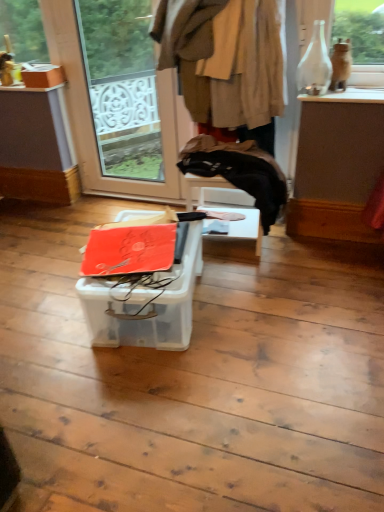
Question: Is orange matte cardboard box at center, the second cardboard box viewed from the top, thinner than brown woolen coat at upper center?

Choices:
 (A) no
 (B) yes

Answer: (A)

Question: Is orange matte cardboard box at center, the second cardboard box in the back-to-front sequence, closer to camera compared to brown woolen coat at upper center?

Choices:
 (A) yes
 (B) no

Answer: (A)

Question: Does orange matte cardboard box at center, which is the 1th cardboard box in bottom-to-top order, touch brown woolen coat at upper center?

Choices:
 (A) yes
 (B) no

Answer: (B)

Question: Does orange matte cardboard box at center, the second cardboard box in the back-to-front sequence, have a greater width compared to brown woolen coat at upper center?

Choices:
 (A) yes
 (B) no

Answer: (A)

Question: Is orange matte cardboard box at center, placed as the 1th cardboard box when sorted from right to left, oriented towards brown woolen coat at upper center?

Choices:
 (A) yes
 (B) no

Answer: (B)

Question: Is point (144, 16) positioned closer to the camera than point (253, 39)?

Choices:
 (A) closer
 (B) farther

Answer: (B)

Question: From the image's perspective, is transparent glass door at upper left located above or below brown woolen coat at upper center?

Choices:
 (A) above
 (B) below

Answer: (B)

Question: Based on their sizes in the image, would you say transparent glass door at upper left is bigger or smaller than brown woolen coat at upper center?

Choices:
 (A) small
 (B) big

Answer: (A)

Question: Is transparent glass door at upper left inside or outside of brown woolen coat at upper center?

Choices:
 (A) outside
 (B) inside

Answer: (A)

Question: Choose the correct answer: Is orange matte cardboard box at center, the second cardboard box in the back-to-front sequence, inside brown woolen coat at upper center or outside it?

Choices:
 (A) inside
 (B) outside

Answer: (B)

Question: Is point (190, 300) positioned closer to the camera than point (225, 119)?

Choices:
 (A) closer
 (B) farther

Answer: (A)

Question: Considering the relative positions of orange matte cardboard box at center, acting as the first cardboard box starting from the front, and brown woolen coat at upper center in the image provided, is orange matte cardboard box at center, acting as the first cardboard box starting from the front, to the left or to the right of brown woolen coat at upper center?

Choices:
 (A) right
 (B) left

Answer: (B)

Question: Considering the positions of orange matte cardboard box at center, acting as the first cardboard box starting from the front, and brown woolen coat at upper center in the image, is orange matte cardboard box at center, acting as the first cardboard box starting from the front, wider or thinner than brown woolen coat at upper center?

Choices:
 (A) wide
 (B) thin

Answer: (A)

Question: In the image, is brown woolen coat at upper center positioned in front of or behind transparent glass door at upper left?

Choices:
 (A) front
 (B) behind

Answer: (A)

Question: From a real-world perspective, is brown woolen coat at upper center physically located above or below transparent glass door at upper left?

Choices:
 (A) above
 (B) below

Answer: (A)